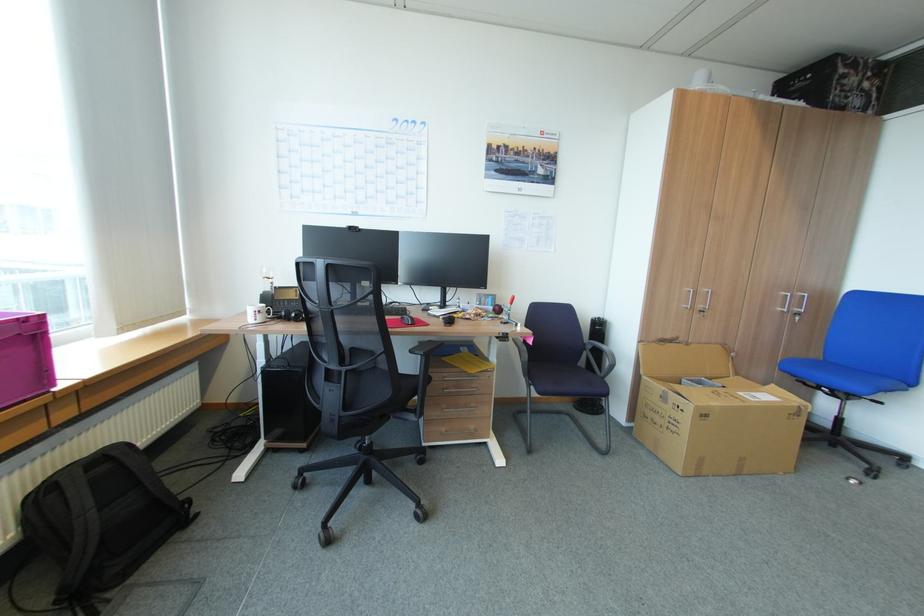
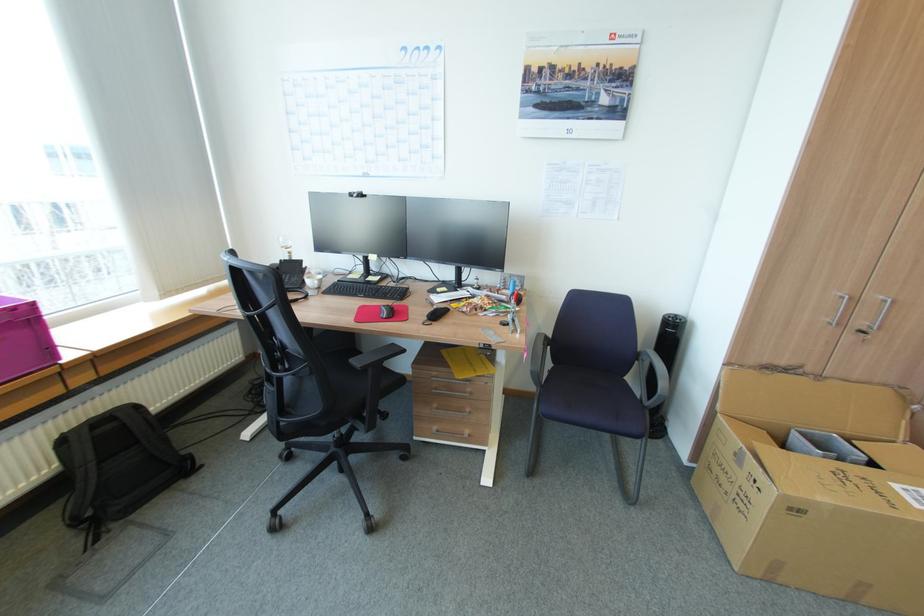
Find the pixel in the second image that matches (x=590, y=342) in the first image.

(643, 350)